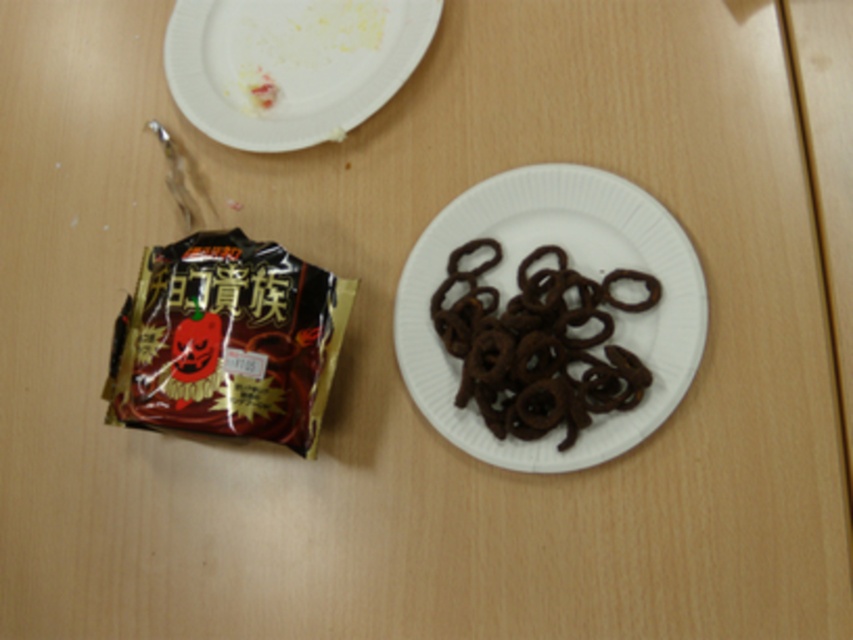
You are arranging snacks on a table for a party. You have a white paper plate at center and a black matte snack at left. According to the image, which snack is positioned closer to the right edge of the table?

The white paper plate at center is positioned closer to the right edge of the table compared to the black matte snack at left.

You are looking at the two plates on the table. Which plate is positioned closer to you, the one at point [151,355] or the one at point [225,93]?

The plate at point [151,355] is closer to you because it is positioned closer to the camera than the plate at point [225,93].

In the scene shown: You are a chef arranging food on a table. You have a black matte snack at left and a white paper plate at upper left. Which item is taller?

The black matte snack at left is taller than the white paper plate at upper left.